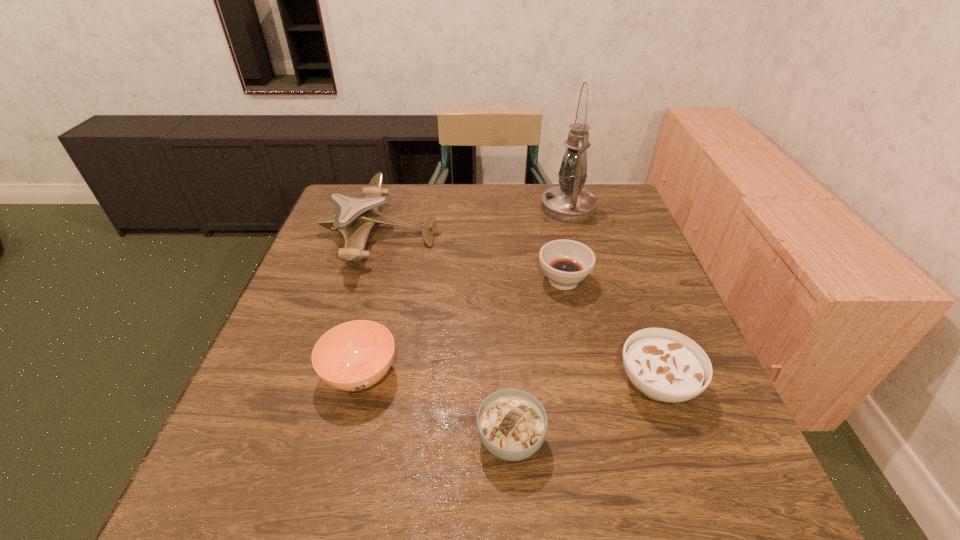
Find the location of a particular element. This screenshot has height=540, width=960. free space between the leftmost soup bowl and the farthest soup bowl is located at coordinates (462, 327).

I want to click on empty space between the leftmost soup bowl and the drone, so click(371, 303).

Locate an element on the screen. The width and height of the screenshot is (960, 540). object that stands as the third closest to the third soup bowl from right to left is located at coordinates (566, 263).

Image resolution: width=960 pixels, height=540 pixels. I want to click on object that is the third closest to the fifth shortest object, so click(569, 203).

Locate an element on the screen. soup bowl that is the third closest to the farthest soup bowl is located at coordinates (355, 355).

Find the location of a particular element. The height and width of the screenshot is (540, 960). soup bowl that is the third closest to the third object from left to right is located at coordinates [x=566, y=263].

The height and width of the screenshot is (540, 960). Find the location of `vacant space that satisfies the following two spatial constraints: 1. on the back side of the farthest soup bowl; 2. on the right side of the tallest object`. vacant space that satisfies the following two spatial constraints: 1. on the back side of the farthest soup bowl; 2. on the right side of the tallest object is located at coordinates pyautogui.click(x=548, y=208).

Where is `blank area in the image that satisfies the following two spatial constraints: 1. on the front side of the oil lamp; 2. on the front-facing side of the drone`? blank area in the image that satisfies the following two spatial constraints: 1. on the front side of the oil lamp; 2. on the front-facing side of the drone is located at coordinates (575, 233).

The width and height of the screenshot is (960, 540). I want to click on vacant position in the image that satisfies the following two spatial constraints: 1. on the back side of the leftmost soup bowl; 2. on the front-facing side of the drone, so click(396, 233).

You are a GUI agent. You are given a task and a screenshot of the screen. Output one action in this format:
    pyautogui.click(x=<x>, y=<y>)
    Task: Click on the free location that satisfies the following two spatial constraints: 1. on the front-facing side of the drone; 2. on the right side of the fourth object from right to left
    
    Given the screenshot: What is the action you would take?
    pyautogui.click(x=320, y=439)